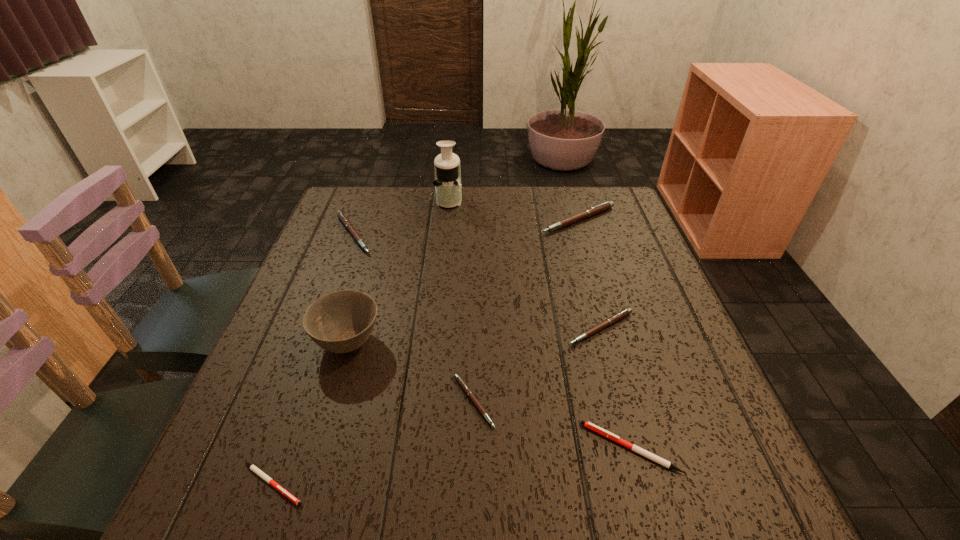
The width and height of the screenshot is (960, 540). What are the coordinates of `the smallest pink pen` in the screenshot? It's located at (463, 385).

Locate an element on the screen. the bigger white pen is located at coordinates (643, 452).

This screenshot has width=960, height=540. I want to click on the shortest object, so click(256, 470).

Find the location of `the left white pen`. the left white pen is located at coordinates (256, 470).

This screenshot has height=540, width=960. What are the coordinates of `free space located 0.200m on the left of the juicer` in the screenshot? It's located at (371, 200).

The width and height of the screenshot is (960, 540). Find the location of `free location located 0.150m on the back of the seventh shortest object`. free location located 0.150m on the back of the seventh shortest object is located at coordinates [369, 273].

At what (x,y) coordinates should I click in order to perform the action: click on vacant space located at the nib of the biggest pink pen. Please return your answer as a coordinate pair (x, y). Looking at the image, I should click on (613, 338).

The width and height of the screenshot is (960, 540). What are the coordinates of `free region located 0.180m at the nib of the fifth shortest pen` in the screenshot? It's located at (441, 234).

This screenshot has width=960, height=540. In order to click on free spot located at the nib of the third biggest pink pen in this screenshot , I will do `click(641, 475)`.

Where is `vacant space located at the nib of the fourth object from right to left`? This screenshot has width=960, height=540. vacant space located at the nib of the fourth object from right to left is located at coordinates (613, 402).